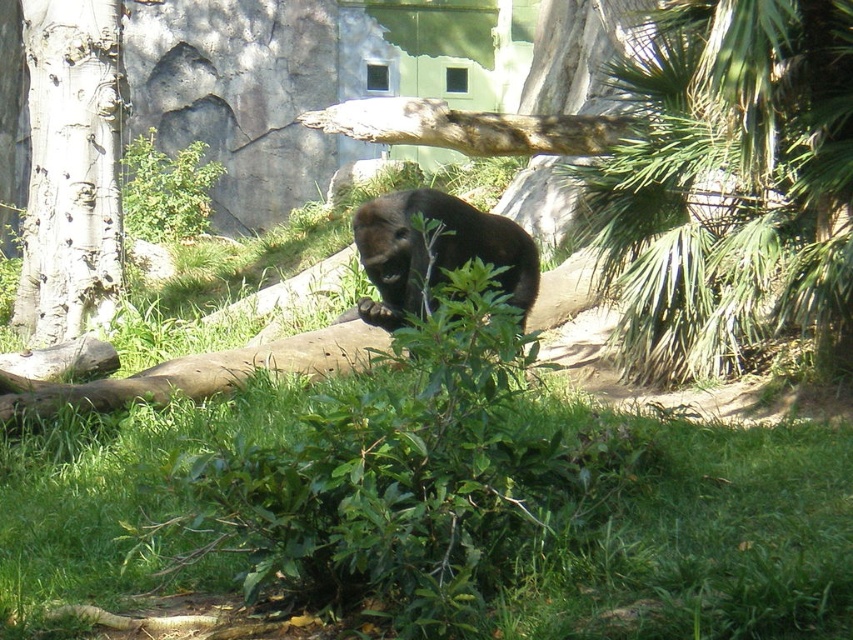
In the scene shown: Which is above, green leafy bush at center or smooth gray bark at left?

Positioned higher is smooth gray bark at left.

From the picture: Is green leafy bush at center smaller than smooth gray bark at left?

Correct, green leafy bush at center occupies less space than smooth gray bark at left.

Find the location of a particular element. The image size is (853, 640). green leafy bush at center is located at coordinates (404, 481).

Which is in front, point (154, 531) or point (781, 92)?

Point (154, 531) is in front.

Based on the photo, is green leafy bush at center to the right of green leafy tree at upper right from the viewer's perspective?

Incorrect, green leafy bush at center is not on the right side of green leafy tree at upper right.

Describe the element at coordinates (404, 481) in the screenshot. I see `green leafy bush at center` at that location.

The width and height of the screenshot is (853, 640). What are the coordinates of `green leafy bush at center` in the screenshot? It's located at (404, 481).

Locate an element on the screen. smooth gray bark at left is located at coordinates (71, 168).

Is smooth gray bark at left smaller than brown furry bear at center?

No.

This screenshot has width=853, height=640. I want to click on smooth gray bark at left, so click(71, 168).